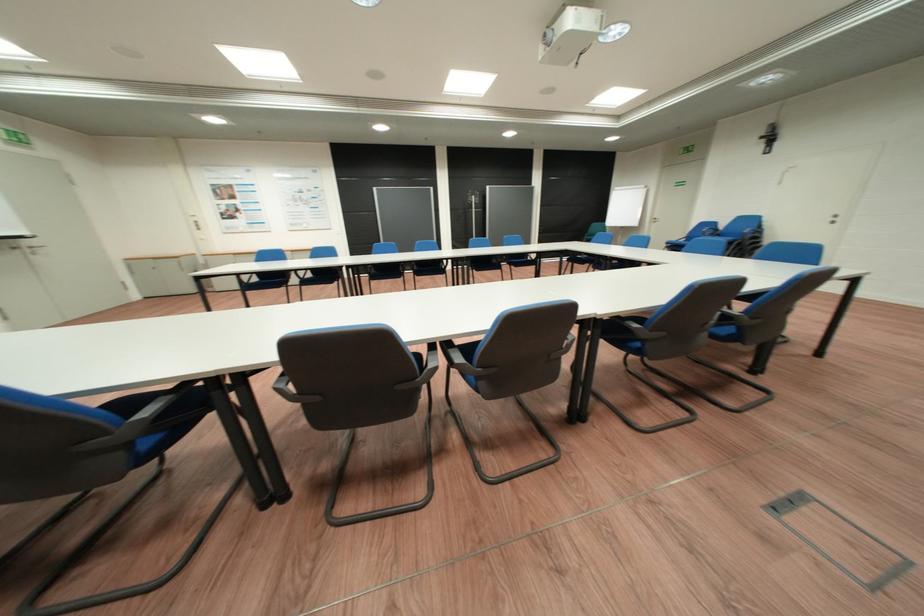
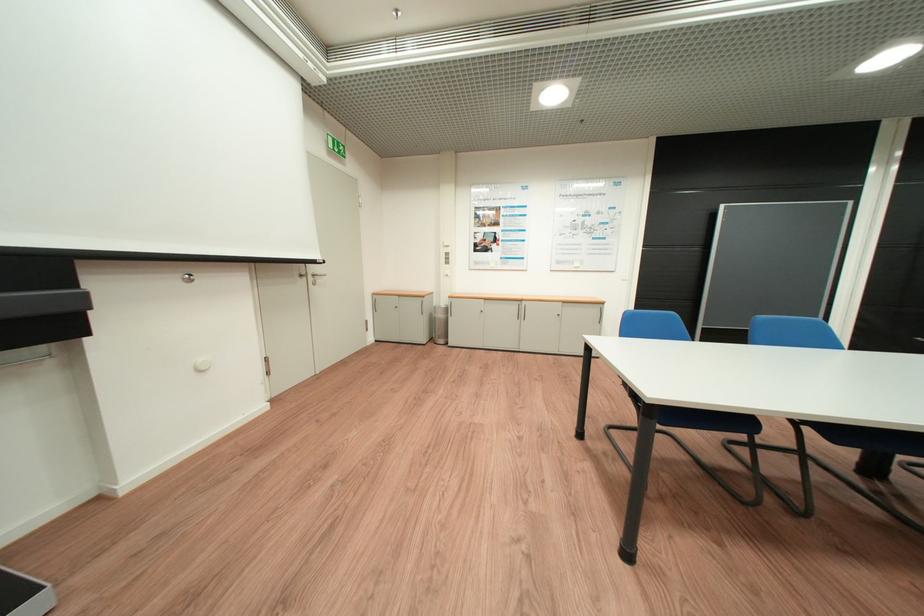
The images are taken continuously from a first-person perspective. In which direction are you moving?

The movement direction of the cameraman is left, forward.